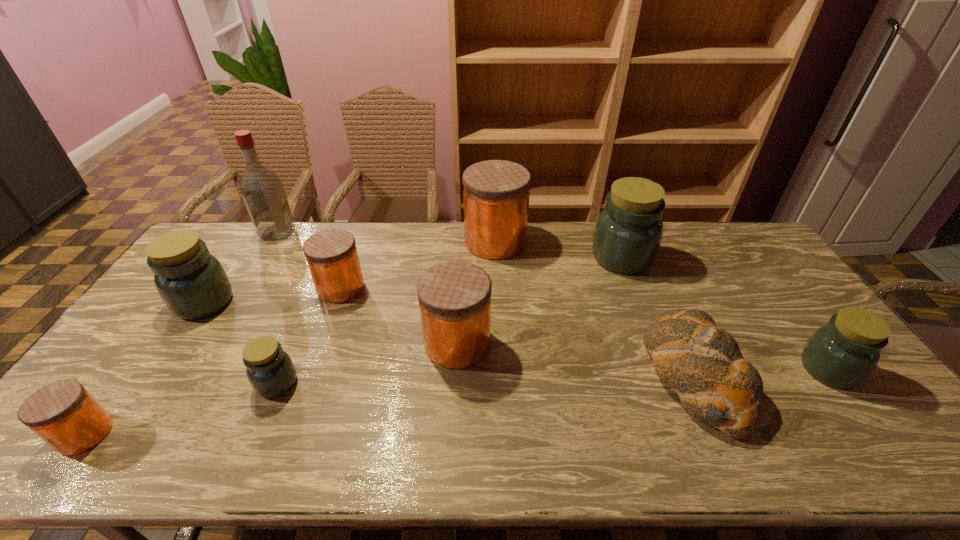
Locate an element on the screen. vacant space positioned on the right of the second orange jar from left to right is located at coordinates (396, 288).

This screenshot has width=960, height=540. What are the coordinates of `free point located 0.290m on the left of the rightmost green jar` in the screenshot? It's located at (692, 369).

In order to click on free space located on the left of the bread in this screenshot , I will do (538, 375).

At what (x,y) coordinates should I click in order to perform the action: click on vacant space located on the left of the smallest green jar. Please return your answer as a coordinate pair (x, y). Looking at the image, I should click on (182, 382).

What are the coordinates of `vacant area situated 0.140m on the right of the smallest orange jar` in the screenshot? It's located at (169, 434).

Locate an element on the screen. The width and height of the screenshot is (960, 540). liquor that is at the far edge is located at coordinates (262, 190).

I want to click on bread located in the near edge section of the desktop, so click(x=701, y=362).

Locate an element on the screen. jar present at the near edge is located at coordinates (65, 415).

Locate an element on the screen. object situated at the right edge is located at coordinates (843, 353).

This screenshot has width=960, height=540. I want to click on object that is at the near left corner, so click(65, 415).